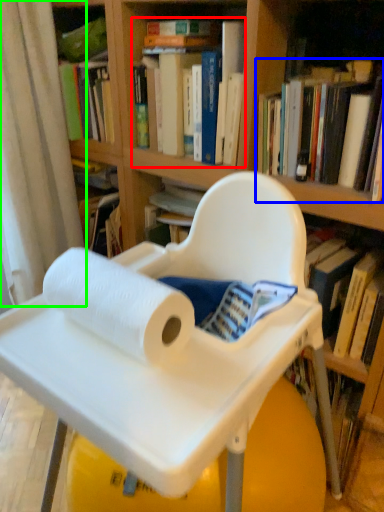
Question: Based on their relative distances, which object is nearer to book (highlighted by a red box)? Choose from book (highlighted by a blue box) and curtain (highlighted by a green box).

Choices:
 (A) book
 (B) curtain

Answer: (A)